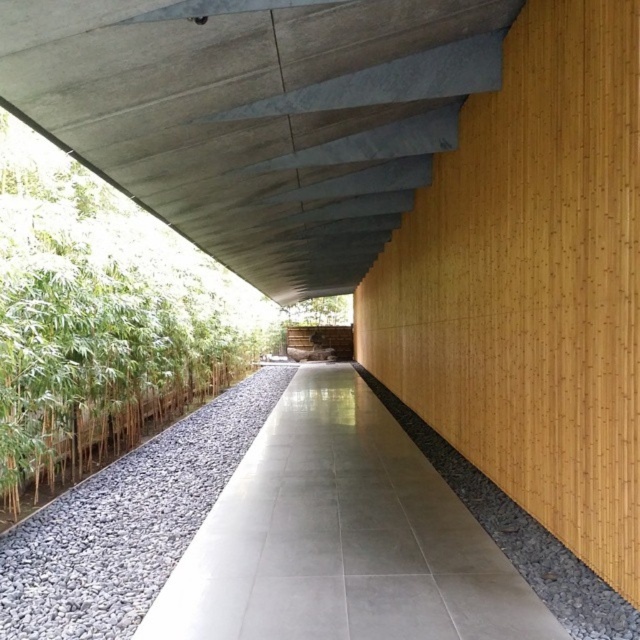
Question: Which object is positioned farthest from the gray gravel at lower center?

Choices:
 (A) gray concrete path at center
 (B) concrete ceiling at upper center
 (C) gray gravel at center-left

Answer: (B)

Question: Which is farther from the concrete ceiling at upper center?

Choices:
 (A) gray concrete path at center
 (B) gray gravel at lower center
 (C) gray gravel at center-left

Answer: (B)

Question: Is concrete ceiling at upper center below gray concrete path at center?

Choices:
 (A) no
 (B) yes

Answer: (A)

Question: Which point is farther to the camera?

Choices:
 (A) (484, 81)
 (B) (168, 532)

Answer: (A)

Question: Can you confirm if concrete ceiling at upper center is positioned to the left of gray gravel at center-left?

Choices:
 (A) no
 (B) yes

Answer: (A)

Question: In this image, where is gray concrete path at center located relative to gray gravel at lower center?

Choices:
 (A) below
 (B) above

Answer: (A)